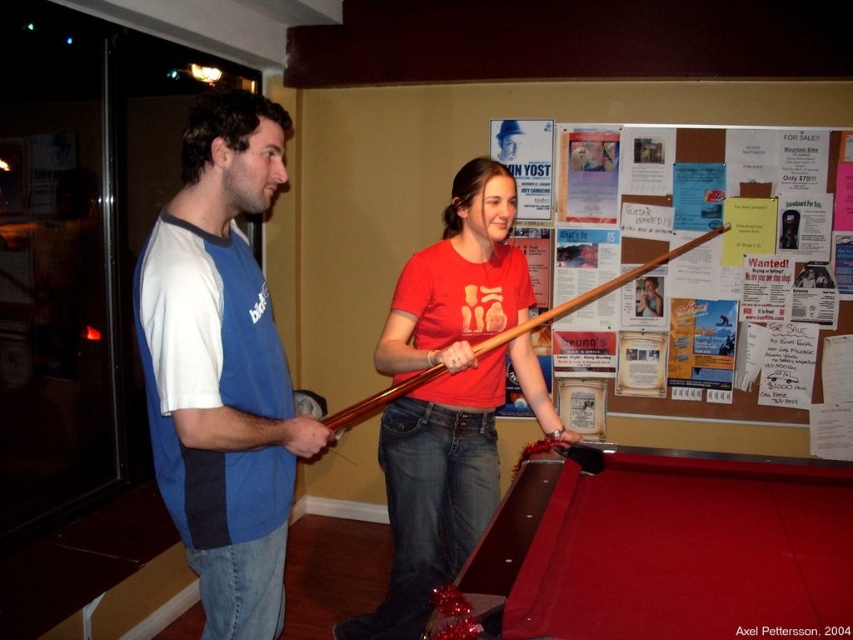
Question: Is matte wood pool cue at center to the left of wooden cue at center from the viewer's perspective?

Choices:
 (A) no
 (B) yes

Answer: (B)

Question: Based on their relative distances, which object is farther from the matte wood pool cue at center?

Choices:
 (A) blue fabric shirt at left
 (B) wooden poster at upper right
 (C) red felt pool table at lower center

Answer: (B)

Question: Does matte wood pool cue at center have a lesser width compared to wooden poster at upper right?

Choices:
 (A) no
 (B) yes

Answer: (B)

Question: Which of the following is the closest to the observer?

Choices:
 (A) matte wood pool cue at center
 (B) wooden cue at center
 (C) red felt pool table at lower center

Answer: (C)

Question: Estimate the real-world distances between objects in this image. Which object is closer to the blue fabric shirt at left?

Choices:
 (A) red felt pool table at lower center
 (B) wooden cue at center

Answer: (B)

Question: Can you confirm if blue fabric shirt at left is thinner than wooden poster at upper right?

Choices:
 (A) no
 (B) yes

Answer: (B)